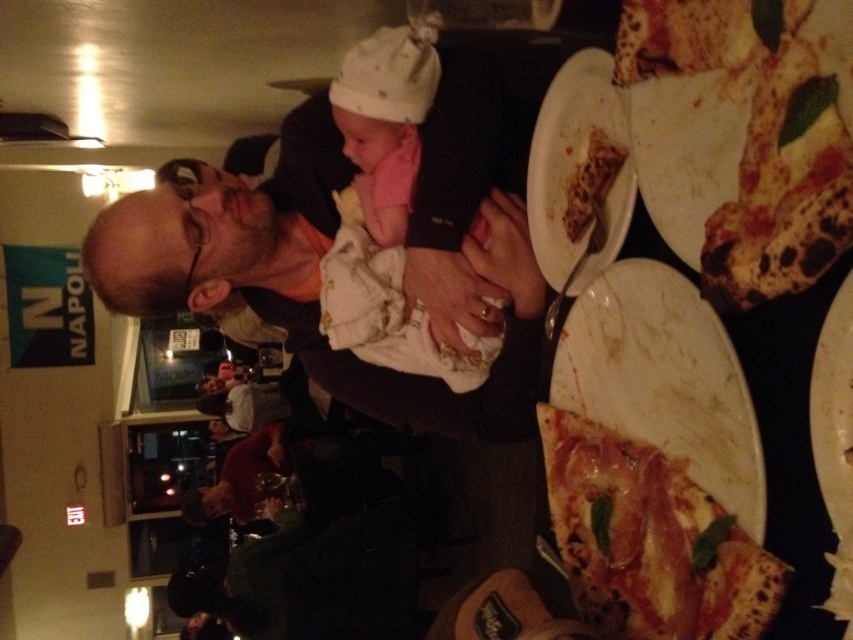
Question: From the image, what is the correct spatial relationship of golden brown crusty pizza at right in relation to crusty golden-brown pizza at upper right?

Choices:
 (A) below
 (B) above

Answer: (A)

Question: Which point appears closest to the camera in this image?

Choices:
 (A) (212, 202)
 (B) (839, 512)
 (C) (543, 168)
 (D) (599, 161)

Answer: (B)

Question: Which point is farther to the camera?

Choices:
 (A) golden crispy pizza slice at upper right
 (B) golden brown crusty pizza at right
 (C) white marble plate at upper right

Answer: (A)

Question: Can you confirm if golden brown crusty pizza at right is positioned above white marble plate at upper right?

Choices:
 (A) yes
 (B) no

Answer: (B)

Question: Which point is closer to the camera taking this photo?

Choices:
 (A) (337, 349)
 (B) (811, 129)
 (C) (560, 490)

Answer: (B)

Question: Can you confirm if white marble plate at lower right is wider than white matte plate at right?

Choices:
 (A) no
 (B) yes

Answer: (B)